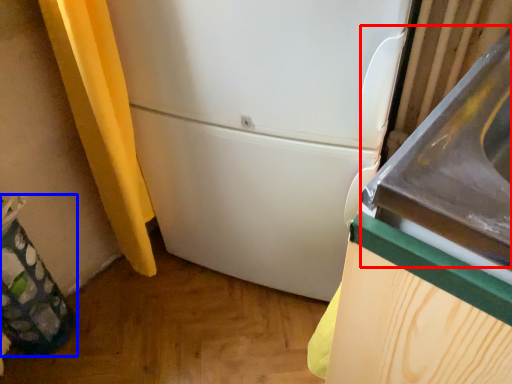
Question: Among these objects, which one is nearest to the camera, sink (highlighted by a red box) or garbage (highlighted by a blue box)?

Choices:
 (A) sink
 (B) garbage

Answer: (A)